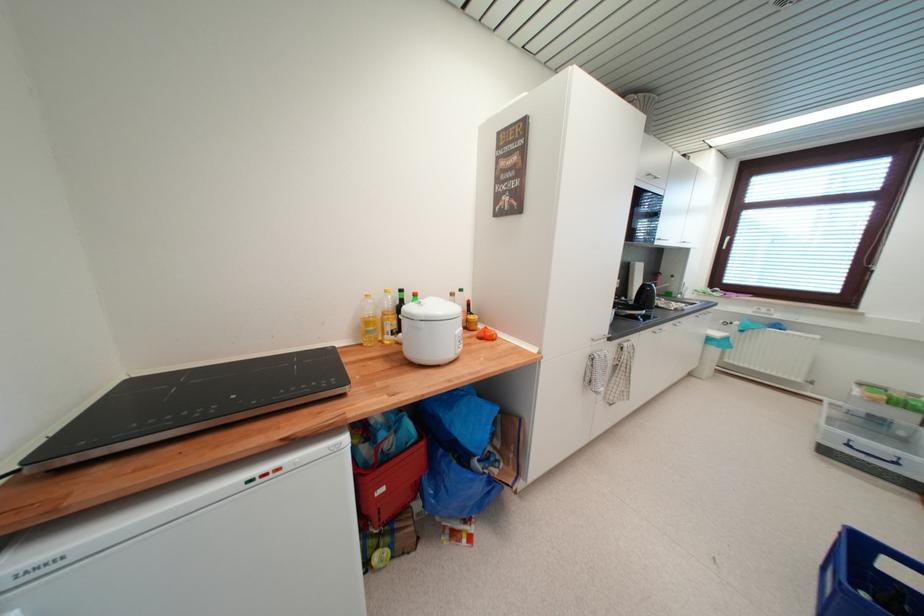
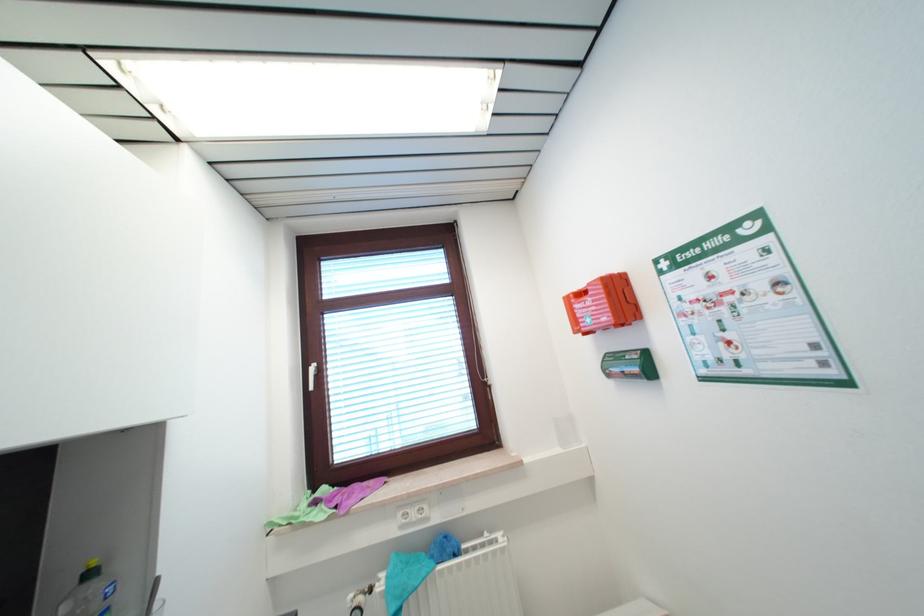
Find the pixel in the second image that matches pixel 712 293 in the first image.

(311, 501)